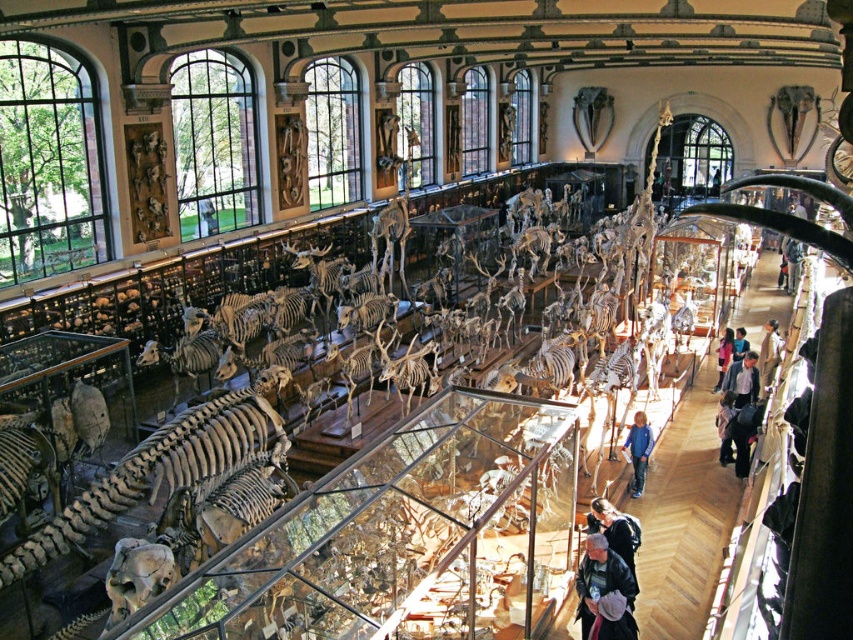
You are a visitor in this museum and you see the blue denim jeans at center and the light brown leather jacket at right. Which one is closer to the floor?

The blue denim jeans at center is located below the light brown leather jacket at right, meaning it is closer to the floor than the jacket.

You are a visitor standing in the museum and see the blue denim jeans at center and the light brown leather jacket at right. Which item is nearer to you?

The blue denim jeans at center is closer to the viewer than the light brown leather jacket at right.

You are standing in the museum and want to place a new exhibit case for a small artifact. The case requires a clear space of 1 meter by 1 meter. Given the light brown leather jacket at right is located at point 0.553, 0.903, can you determine if there is sufficient space near it to place the exhibit case?

The light brown leather jacket at right is located at point (x=769, y=353). However, without knowing the dimensions of the room or the distance between objects, it is impossible to determine if there is enough space to place the exhibit case near it.